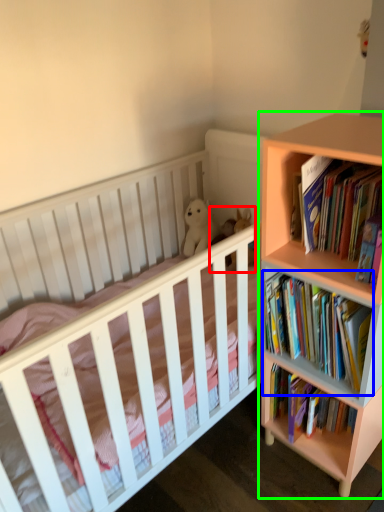
Question: Based on their relative distances, which object is nearer to toy (highlighted by a red box)? Choose from book (highlighted by a blue box) and bookcase (highlighted by a green box).

Choices:
 (A) book
 (B) bookcase

Answer: (A)